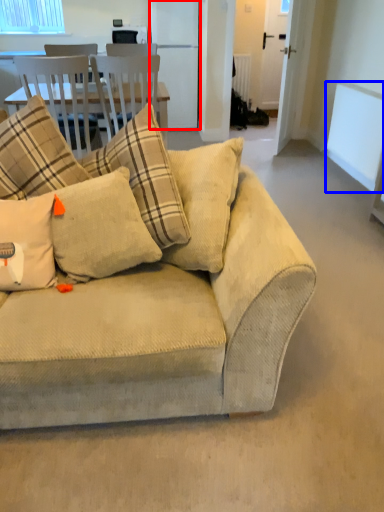
Question: Which point is further to the camera, appliance (highlighted by a red box) or window screen (highlighted by a blue box)?

Choices:
 (A) appliance
 (B) window screen

Answer: (A)